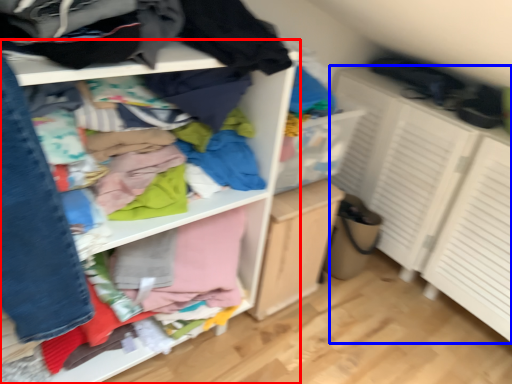
Question: Which point is closer to the camera, shelf (highlighted by a red box) or cabinetry (highlighted by a blue box)?

Choices:
 (A) shelf
 (B) cabinetry

Answer: (A)